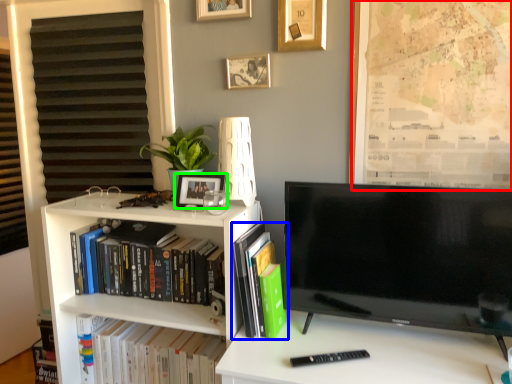
Question: Based on their relative distances, which object is nearer to bulletin board (highlighted by a red box)? Choose from book (highlighted by a blue box) and picture frame (highlighted by a green box).

Choices:
 (A) book
 (B) picture frame

Answer: (A)